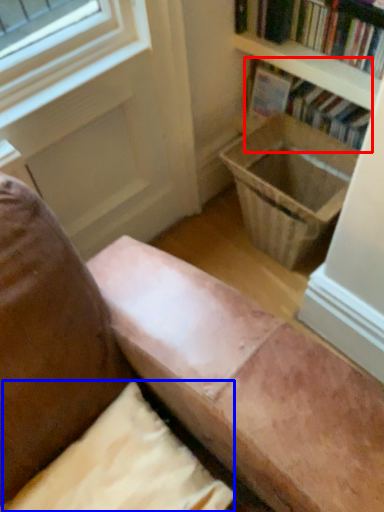
Question: Which object is closer to the camera taking this photo, book (highlighted by a red box) or pillow (highlighted by a blue box)?

Choices:
 (A) book
 (B) pillow

Answer: (B)